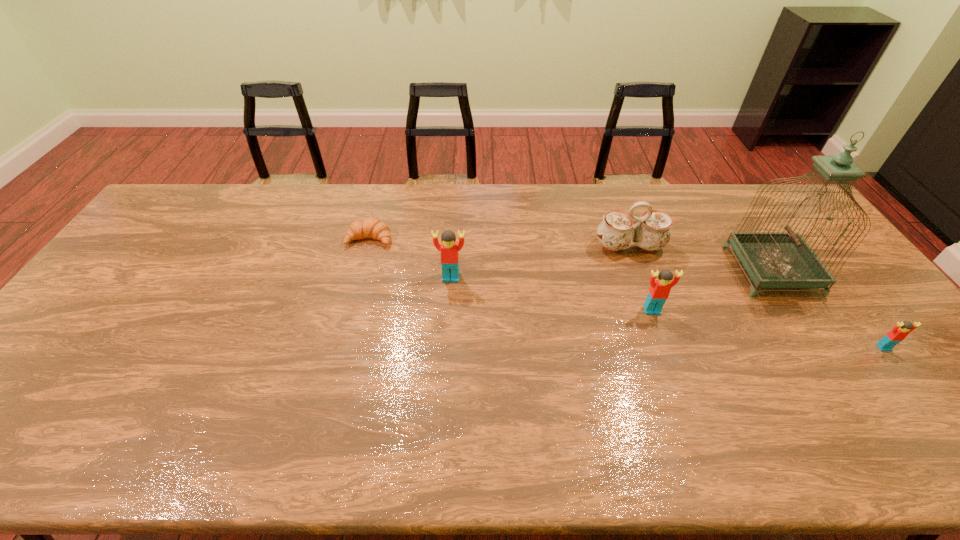
What are the coordinates of `chinaware` in the screenshot? It's located at (617, 231).

This screenshot has width=960, height=540. In order to click on free space located 0.290m on the face of the leftmost Lego in this screenshot , I will do click(x=445, y=368).

Find the location of a particular element. This screenshot has height=540, width=960. free space located 0.170m on the face of the second tallest Lego is located at coordinates (673, 368).

Find the location of `vacant space located on the face of the rightmost object`. vacant space located on the face of the rightmost object is located at coordinates (911, 383).

This screenshot has width=960, height=540. Identify the location of blank area located at the door of the second object from right to left. (649, 270).

At what (x,y) coordinates should I click in order to perform the action: click on free space located at the door of the second object from right to left. Please return your answer as a coordinate pair (x, y). Looking at the image, I should click on (702, 270).

You are a GUI agent. You are given a task and a screenshot of the screen. Output one action in this format:
    pyautogui.click(x=<x>, y=<y>)
    Task: Click on the free region located 0.130m at the door of the second object from right to left
    Image resolution: width=960 pixels, height=540 pixels.
    Given the screenshot: What is the action you would take?
    pyautogui.click(x=692, y=270)

Identify the location of vacant space situated on the back of the crescent roll. (384, 185).

This screenshot has height=540, width=960. I want to click on blank space located 0.180m by the handle of the chinaware, so click(649, 303).

This screenshot has width=960, height=540. I want to click on Lego located in the right edge section of the desktop, so click(x=901, y=330).